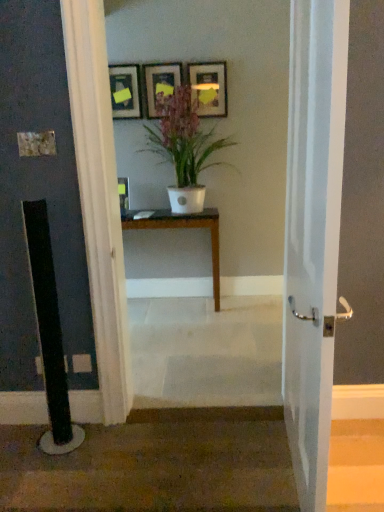
Question: In the image, is brown carpet at lower left positioned in front of or behind matte black picture frame at upper center, the first picture frame positioned from the left?

Choices:
 (A) front
 (B) behind

Answer: (A)

Question: In terms of size, does brown carpet at lower left appear bigger or smaller than matte black picture frame at upper center, the first picture frame positioned from the left?

Choices:
 (A) big
 (B) small

Answer: (A)

Question: Which of these objects is positioned farthest from the matte gold picture frame at upper center, acting as the first picture frame starting from the right?

Choices:
 (A) white glossy door at center
 (B) matte black picture frame at upper center, positioned as the 3th picture frame in right-to-left order
 (C) white matte pot at center
 (D) wooden table at center
 (E) matte wooden picture frame at upper center, acting as the second picture frame starting from the right

Answer: (A)

Question: Estimate the real-world distances between objects in this image. Which object is closer to the matte black picture frame at upper center, positioned as the 3th picture frame in right-to-left order?

Choices:
 (A) matte wooden picture frame at upper center, the second picture frame positioned from the left
 (B) matte gold picture frame at upper center, acting as the first picture frame starting from the right
 (C) brown carpet at lower left
 (D) white matte pot at center
 (E) wooden table at center

Answer: (A)